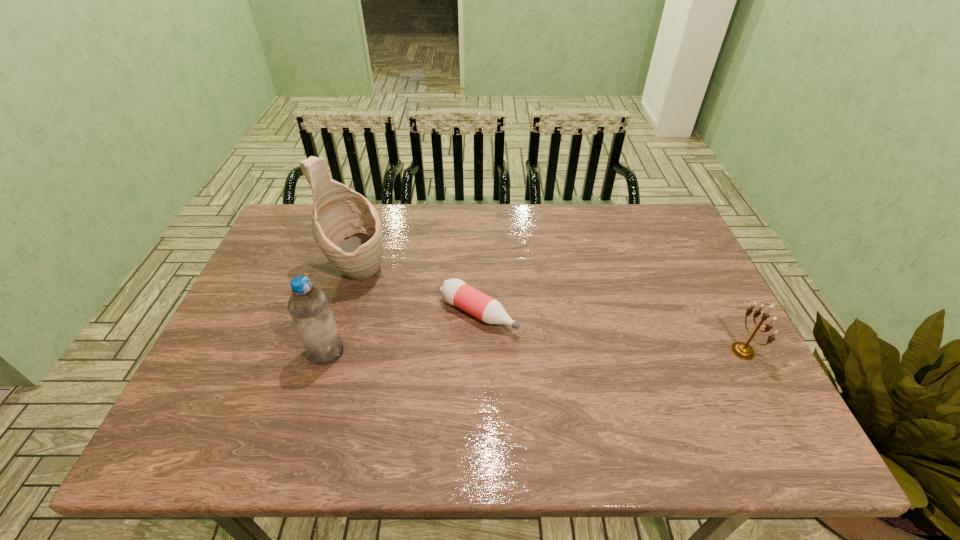
Where is `free spot on the desktop that is between the third shortest object and the candelabrum and is positioned at the spout of the pitcher`? free spot on the desktop that is between the third shortest object and the candelabrum and is positioned at the spout of the pitcher is located at coordinates (480, 352).

I want to click on free space on the desktop that is between the second tallest object and the candelabrum and is positioned with the cap open on the bottle, so click(x=546, y=352).